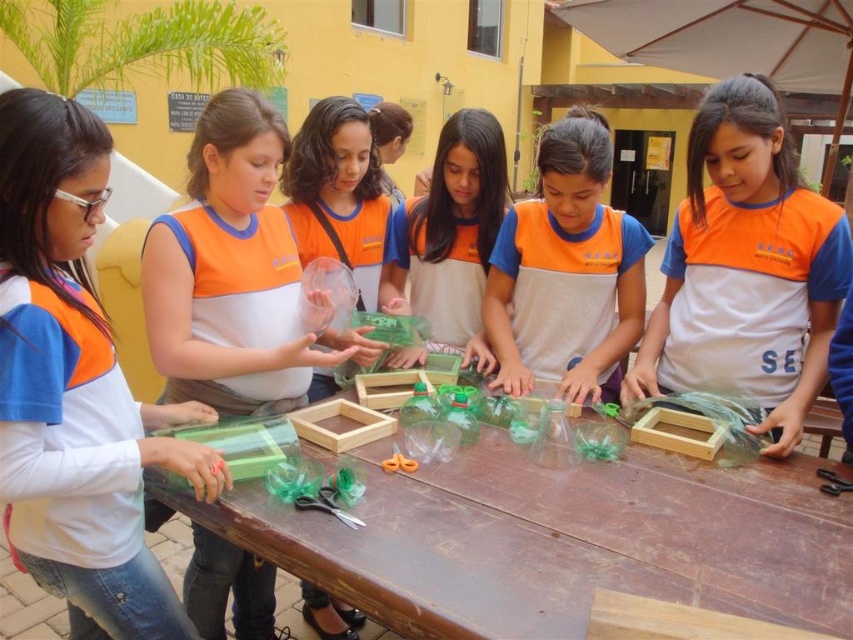
Looking at this image, does matte orange vest at center appear on the left side of orange plastic scissors at center?

In fact, matte orange vest at center is to the right of orange plastic scissors at center.

From the picture: Is the position of matte orange vest at center less distant than that of orange plastic scissors at center?

No, matte orange vest at center is behind orange plastic scissors at center.

Is point (547, 241) positioned in front of point (415, 464)?

No, it is behind (415, 464).

Identify the location of matte orange vest at center. This screenshot has height=640, width=853. (566, 272).

Where is `brown wooden table at center`? brown wooden table at center is located at coordinates (556, 540).

Is point (616, 557) in front of point (41, 419)?

No, (616, 557) is further to viewer.

Is point (515, 516) farther from viewer compared to point (20, 381)?

Yes, point (515, 516) is behind point (20, 381).

You are a GUI agent. You are given a task and a screenshot of the screen. Output one action in this format:
    pyautogui.click(x=<x>, y=<y>)
    Task: Click on the brown wooden table at center
    
    Given the screenshot: What is the action you would take?
    pyautogui.click(x=556, y=540)

Measure the distance between brown wooden table at center and orange fabric shirt at center.

brown wooden table at center and orange fabric shirt at center are 24.82 inches apart.

You are a GUI agent. You are given a task and a screenshot of the screen. Output one action in this format:
    pyautogui.click(x=<x>, y=<y>)
    Task: Click on the brown wooden table at center
    The width and height of the screenshot is (853, 640).
    Given the screenshot: What is the action you would take?
    pyautogui.click(x=556, y=540)